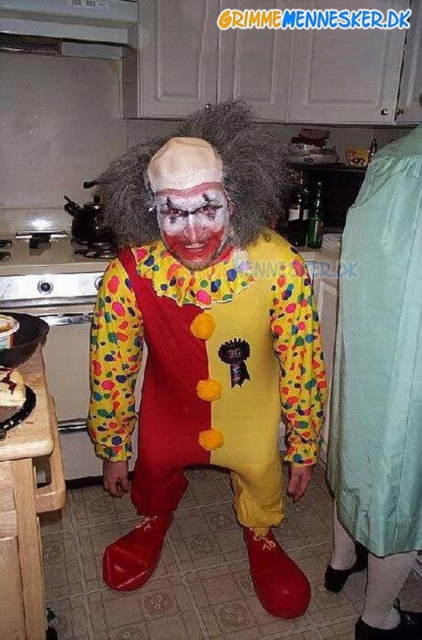
Question: Estimate the real-world distances between objects in this image. Which object is closer to the matte yellow clown suit at center?

Choices:
 (A) light blue fabric at right
 (B) fuzzy brown wig at center
 (C) matte clown face at center

Answer: (A)

Question: In this image, where is light blue fabric at right located relative to fuzzy brown wig at center?

Choices:
 (A) below
 (B) above

Answer: (A)

Question: From the image, what is the correct spatial relationship of matte yellow clown suit at center in relation to light blue fabric at right?

Choices:
 (A) left
 (B) right

Answer: (A)

Question: Which object appears closest to the camera in this image?

Choices:
 (A) light blue fabric at right
 (B) fuzzy brown wig at center
 (C) matte yellow clown suit at center
 (D) matte clown face at center

Answer: (D)

Question: Is the position of matte yellow clown suit at center more distant than that of light blue fabric at right?

Choices:
 (A) yes
 (B) no

Answer: (B)

Question: Which point is closer to the camera taking this photo?

Choices:
 (A) (246, 406)
 (B) (189, 264)
 (C) (410, 356)

Answer: (B)